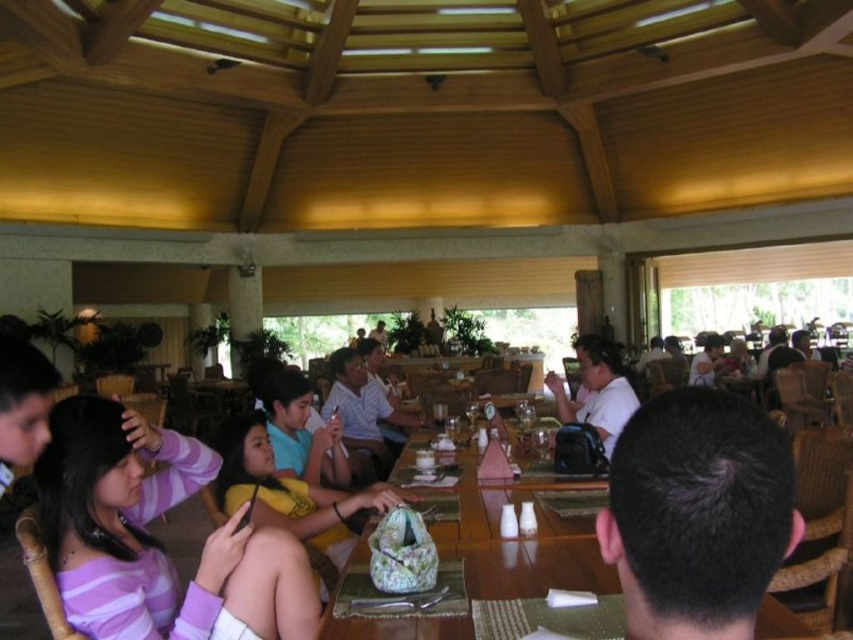
Question: Which object is the closest to the striped fabric shirt at left?

Choices:
 (A) white shirt at center
 (B) matte white shirt at center
 (C) floral fabric bag at center
 (D) dark brown hair at center

Answer: (C)

Question: Does floral fabric bag at center appear on the right side of matte white shirt at center?

Choices:
 (A) no
 (B) yes

Answer: (A)

Question: In this image, where is striped fabric shirt at left located relative to white shirt at center?

Choices:
 (A) right
 (B) left

Answer: (B)

Question: Which point appears farthest from the camera in this image?

Choices:
 (A) (76, 403)
 (B) (697, 532)
 (C) (616, 428)
 (D) (364, 444)

Answer: (D)

Question: From the image, what is the correct spatial relationship of matte blue shirt at center in relation to white shirt at center?

Choices:
 (A) above
 (B) below

Answer: (A)

Question: Which object appears closest to the camera in this image?

Choices:
 (A) matte white shirt at center
 (B) floral fabric bag at center
 (C) striped fabric shirt at left

Answer: (B)